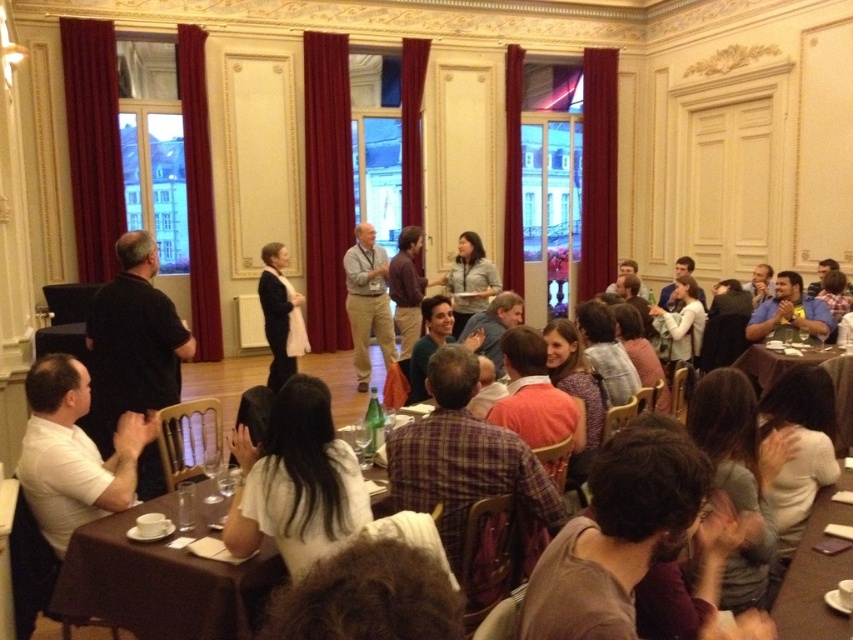
You are a photographer positioned at the entrance of the room. You need to capture a photo of the light gray shirt at center without including the brown wooden table at lower right in the frame. Is this possible based on their positions?

The brown wooden table at lower right is behind the light gray shirt at center, so yes, the photographer can capture the light gray shirt at center without including the brown wooden table at lower right in the frame since it is obscured by the person in front.

What are the coordinates of the light gray shirt at center in the image?

The light gray shirt at center is located at coordinates point (367, 301).

You are a photographer standing at the back of the room. You need to take a photo of the light gray shirt at center and the matte black coat at center. Which one will be more visible in the photo due to its height?

The light gray shirt at center is much taller than the matte black coat at center, so it will be more visible in the photo.